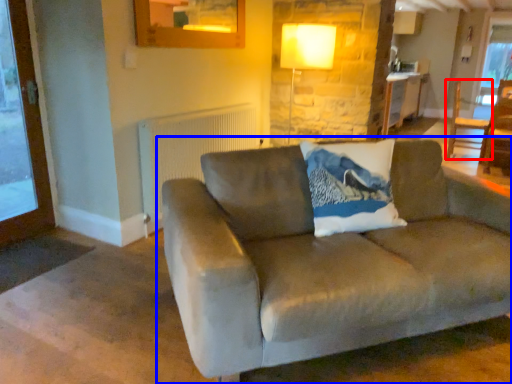
Question: Which of the following is the farthest to the observer, chair (highlighted by a red box) or studio couch (highlighted by a blue box)?

Choices:
 (A) chair
 (B) studio couch

Answer: (A)